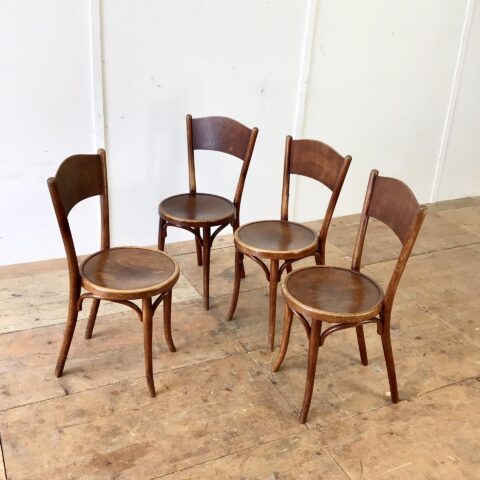
What are the coordinates of `chair` in the screenshot? It's located at (134, 266), (186, 208), (290, 231), (332, 293).